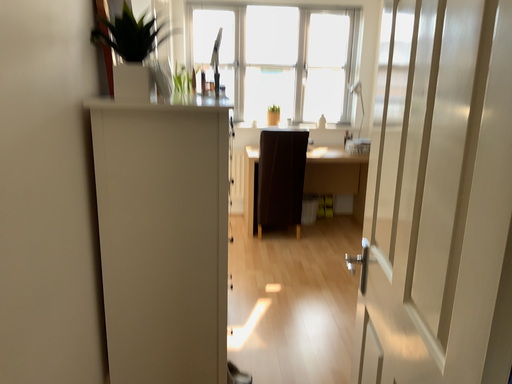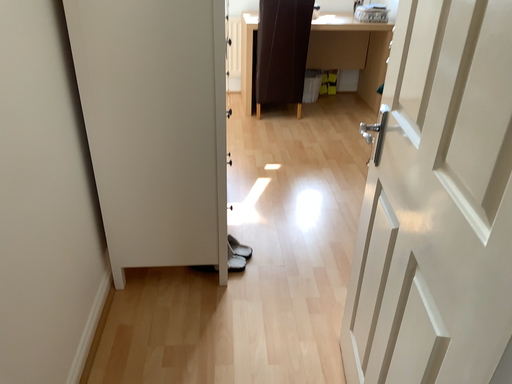
Question: How did the camera likely rotate when shooting the video?

Choices:
 (A) rotated downward
 (B) rotated upward

Answer: (A)